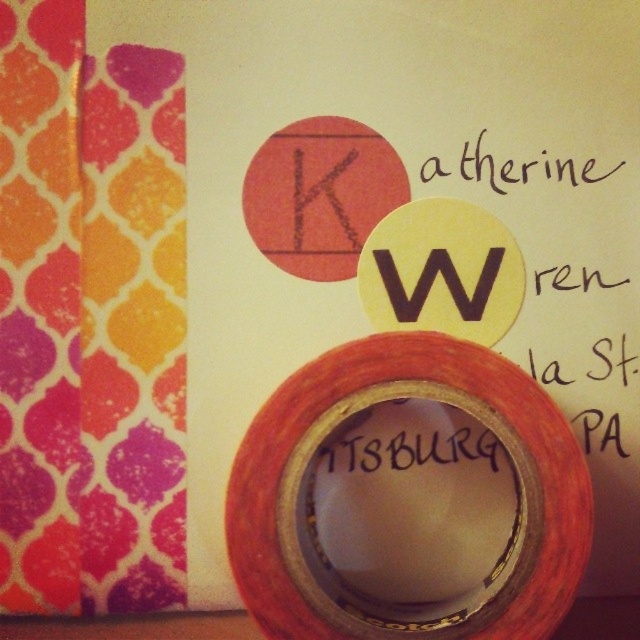
You are an artist working on a project and need to place a matte orange tape at center on the image. Where exactly should you place it?

You should place the matte orange tape at center at point (408, 499).

You are holding a measuring tool and need to determine if a 3.5 feet long object can be placed from the camera to the point at point (369, 556) without bending it. Can it fit?

The distance between the camera and point (369, 556) is 3.62 feet, which is slightly longer than the 3.5 feet object. Therefore, the object cannot fit without bending.

You are organizing a mail sorting station and need to know the spatial relationship between the matte orange tape at center and the black paper at upper center. Which object is positioned to the left of the other?

The matte orange tape at center is to the left of the black paper at upper center.